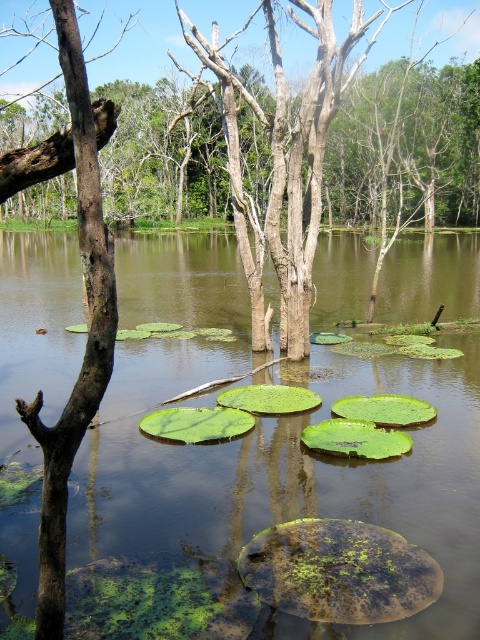
You are standing on the bank of the pond and see the green leafy lily pads at center and the smooth brown tree trunk at left. Which object is closer to your right side?

The green leafy lily pads at center are to the right of the smooth brown tree trunk at left, so they are closer to your right side.

You are standing at the edge of the wetland scene, and you want to know how far the point at coordinates point (186, 244) is from your current position. Can you determine the distance?

The distance of point (186, 244) from the camera is 67.21 meters, so the point is 67.21 meters away from your current position.

You are a frog trying to jump from the green leafy lily pads at center to the smooth brown tree trunk at left. Considering their sizes, which one do you think will be easier to land on?

The green leafy lily pads at center are larger in size than the smooth brown tree trunk at left, so it will be easier for the frog to land on the green leafy lily pads at center.